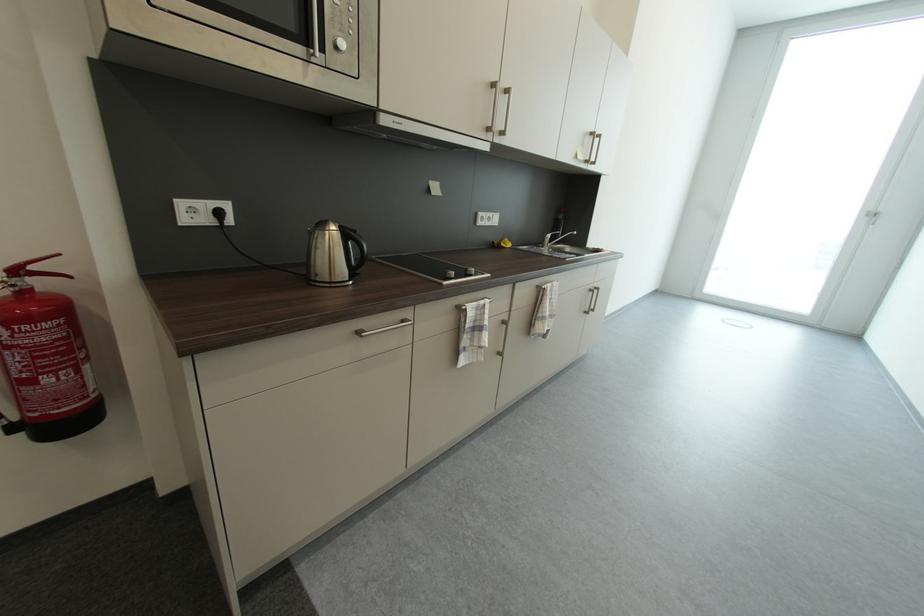
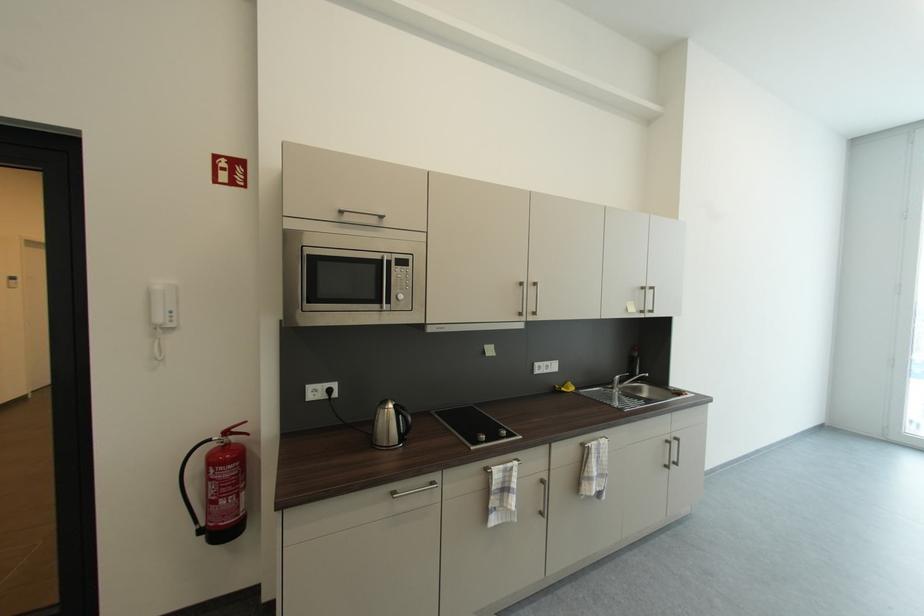
In the second image, find the point that corresponds to point (346, 228) in the first image.

(400, 407)